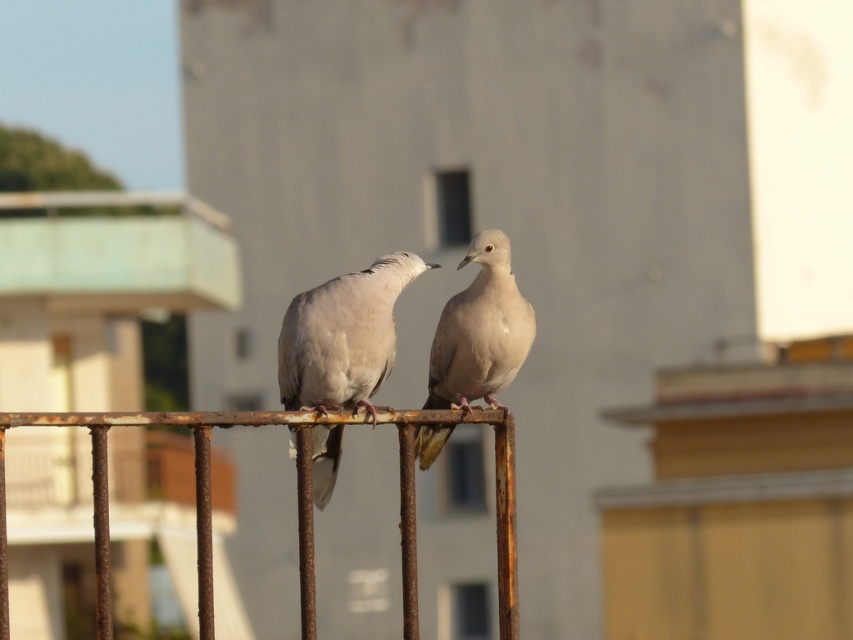
Does matte white dove at center have a lesser width compared to light beige feathered dove at center?

Incorrect, matte white dove at center's width is not less than light beige feathered dove at center's.

Between point (309, 408) and point (492, 342), which one is positioned in front?

Point (309, 408) is in front.

The width and height of the screenshot is (853, 640). I want to click on matte white dove at center, so click(x=343, y=337).

How much distance is there between rusty metal fence at center and light beige feathered dove at center?

The distance of rusty metal fence at center from light beige feathered dove at center is 30.50 inches.

Which is more to the right, rusty metal fence at center or light beige feathered dove at center?

Positioned to the right is rusty metal fence at center.

Describe the element at coordinates (106, 492) in the screenshot. I see `rusty metal fence at center` at that location.

The width and height of the screenshot is (853, 640). I want to click on rusty metal fence at center, so click(x=106, y=492).

Which is behind, point (509, 557) or point (360, 276)?

Point (360, 276)

Who is more forward, (x=207, y=448) or (x=323, y=323)?

Point (x=207, y=448) is in front.

Is point (202, 604) more distant than point (311, 307)?

No, (202, 604) is in front of (311, 307).

This screenshot has height=640, width=853. What are the coordinates of `rusty metal fence at center` in the screenshot? It's located at (106, 492).